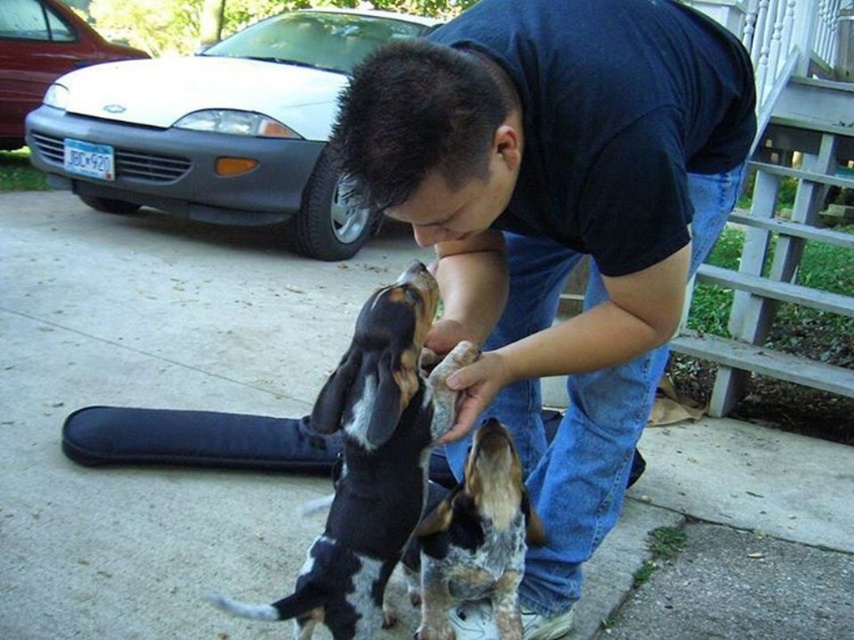
Question: Does black and white fur dog at center appear over spotted fur dog at center?

Choices:
 (A) yes
 (B) no

Answer: (A)

Question: Which point appears closest to the camera in this image?

Choices:
 (A) (488, 554)
 (B) (398, 557)
 (C) (433, 346)

Answer: (B)

Question: Does black cotton shirt at center appear on the left side of spotted fur dog at center?

Choices:
 (A) no
 (B) yes

Answer: (A)

Question: Does black cotton shirt at center appear under spotted fur dog at center?

Choices:
 (A) no
 (B) yes

Answer: (A)

Question: Which point is farther from the camera taking this photo?

Choices:
 (A) (613, 336)
 (B) (446, 525)
 (C) (417, 416)

Answer: (B)

Question: Which point is closer to the camera?

Choices:
 (A) (537, 534)
 (B) (382, 326)

Answer: (B)